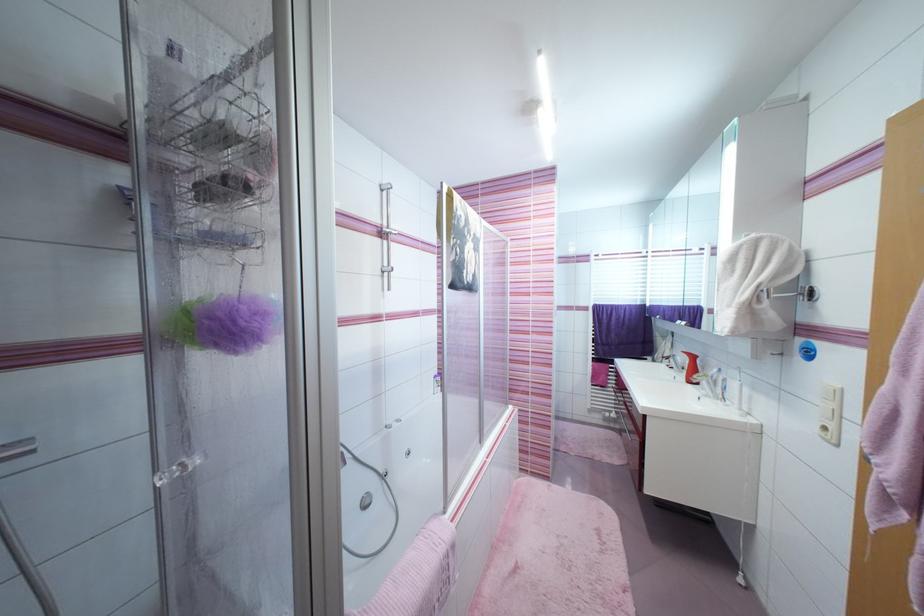
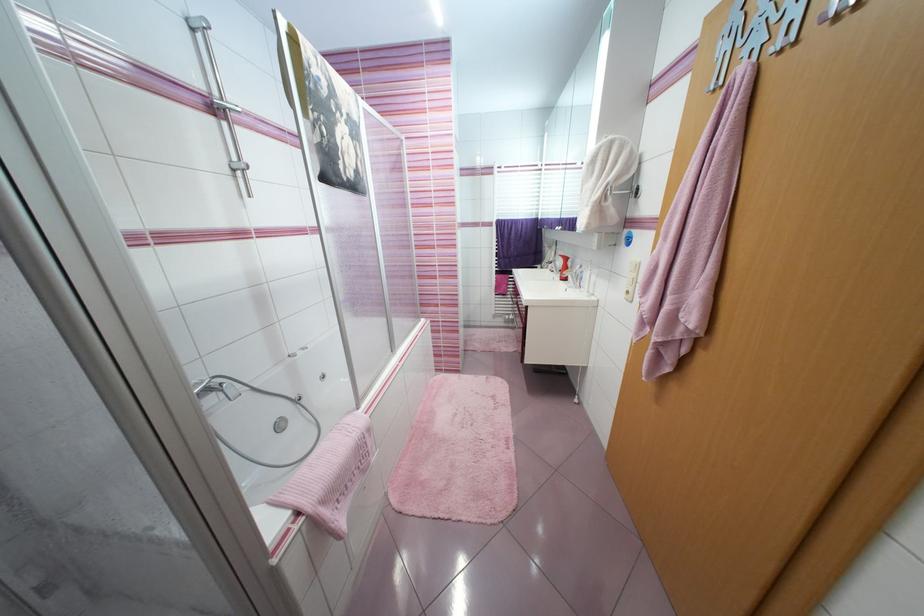
Find the pixel in the second image that matches [831,430] in the first image.

(633, 293)